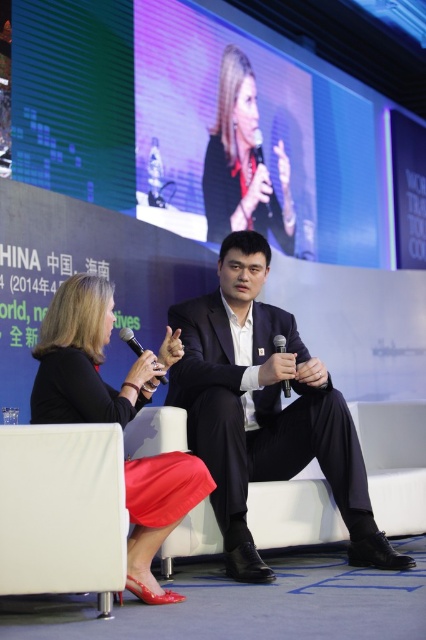
Question: Among these objects, which one is nearest to the camera?

Choices:
 (A) matte black jacket at upper center
 (B) dark blue suit at center
 (C) white fabric chair at lower right

Answer: (B)

Question: Does white fabric chair at lower left have a larger size compared to white fabric chair at lower right?

Choices:
 (A) yes
 (B) no

Answer: (B)

Question: Does matte black dress at center appear on the right side of matte black jacket at upper center?

Choices:
 (A) yes
 (B) no

Answer: (B)

Question: Among these objects, which one is farthest from the camera?

Choices:
 (A) matte black dress at center
 (B) dark blue suit at center
 (C) white fabric chair at lower right
 (D) matte black jacket at upper center

Answer: (D)

Question: Does dark blue suit at center lie in front of white fabric chair at lower left?

Choices:
 (A) yes
 (B) no

Answer: (B)

Question: Which of these objects is positioned farthest from the white fabric chair at lower left?

Choices:
 (A) dark blue suit at center
 (B) matte black jacket at upper center

Answer: (B)